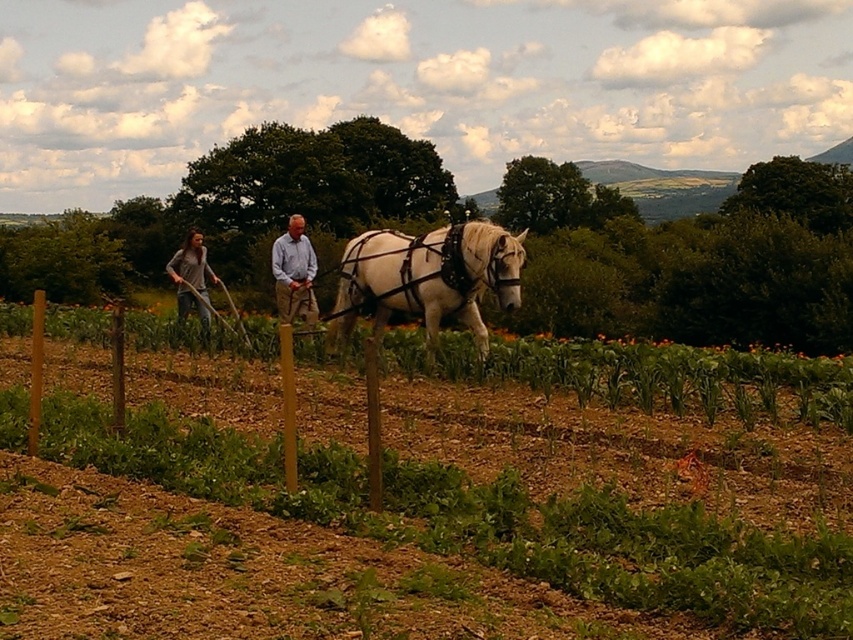
Is green leafy vines at center above white glossy horse at center?

No.

Is green leafy vines at center shorter than white glossy horse at center?

Correct, green leafy vines at center is not as tall as white glossy horse at center.

Between point (735, 452) and point (450, 304), which one is positioned in front?

Point (735, 452) is more forward.

Locate an element on the screen. This screenshot has height=640, width=853. green leafy vines at center is located at coordinates (485, 476).

Is white glossy horse at center behind gray cotton shirt at left?

No, white glossy horse at center is closer to the viewer.

Describe the element at coordinates (426, 278) in the screenshot. The width and height of the screenshot is (853, 640). I see `white glossy horse at center` at that location.

The image size is (853, 640). Identify the location of white glossy horse at center. (426, 278).

Can you confirm if white glossy horse at center is positioned to the right of light brown cotton shirt at center?

Correct, you'll find white glossy horse at center to the right of light brown cotton shirt at center.

Which is more to the right, white glossy horse at center or light brown cotton shirt at center?

Positioned to the right is white glossy horse at center.

Is point (357, 268) positioned after point (303, 227)?

No, (357, 268) is closer to viewer.

At what (x,y) coordinates should I click in order to perform the action: click on white glossy horse at center. Please return your answer as a coordinate pair (x, y). Looking at the image, I should click on (426, 278).